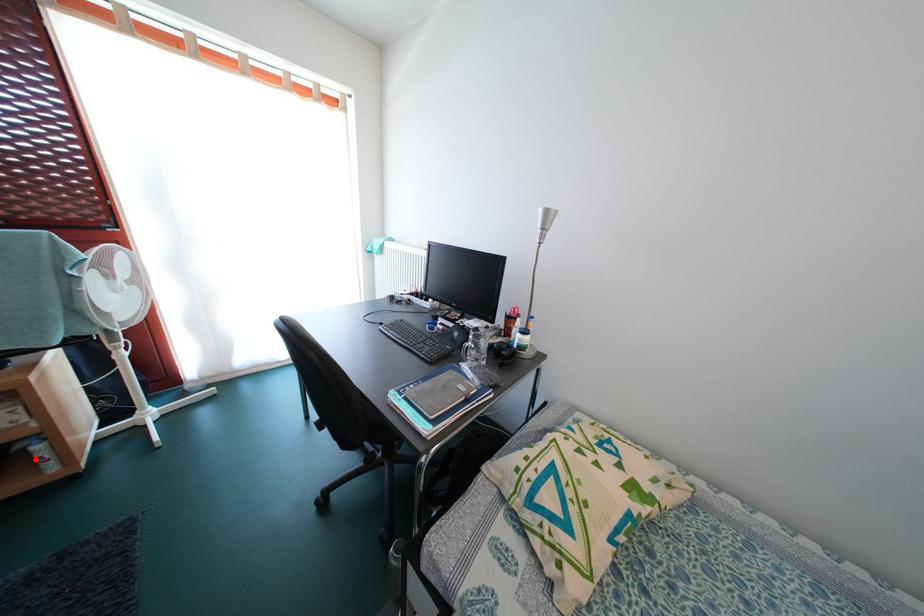
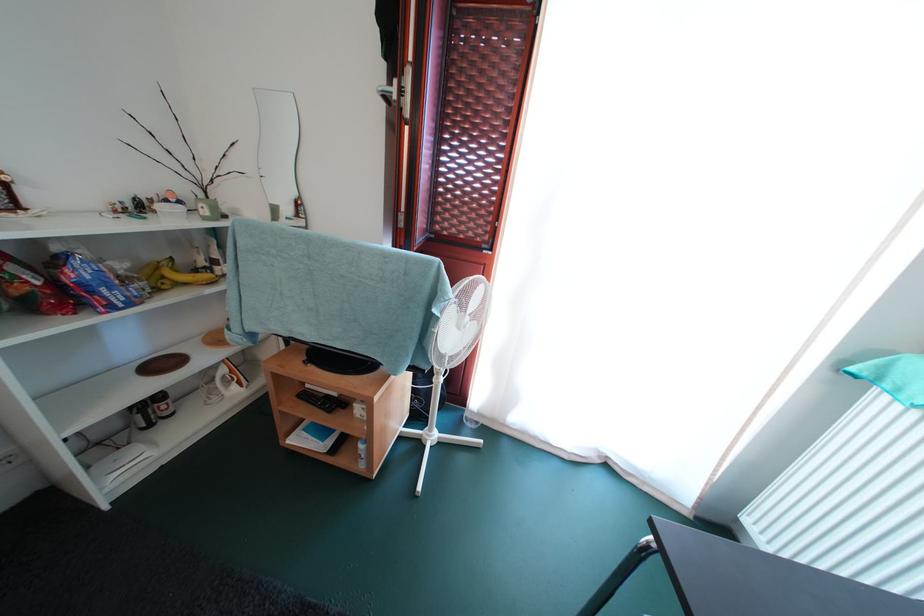
Question: I am providing you with two images of the same scene from different viewpoints. Given a red point in image1, look at the same physical point in image2. Is it:

Choices:
 (A) Closer to the viewpoint
 (B) Farther from the viewpoint

Answer: (B)